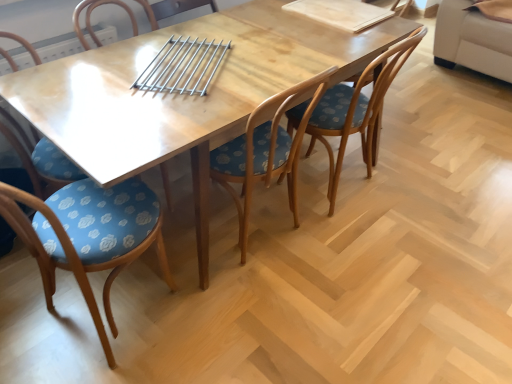
Question: From a real-world perspective, is wooden chair with floral cushion at center, the second chair in the right-to-left sequence, positioned above or below wooden table at center?

Choices:
 (A) above
 (B) below

Answer: (A)

Question: In terms of width, does wooden chair with floral cushion at center, the second chair in the right-to-left sequence, look wider or thinner when compared to wooden table at center?

Choices:
 (A) thin
 (B) wide

Answer: (A)

Question: Based on their relative distances, which object is farther from the blue fabric chair at center, marked as the second chair in a left-to-right arrangement?

Choices:
 (A) wooden chair with floral cushion at center, the second chair in the right-to-left sequence
 (B) wooden chair with floral cushion at center, acting as the 1th chair starting from the right
 (C) wooden table at center
 (D) blue floral fabric chair at lower left, which is the 1th chair from left to right

Answer: (B)

Question: Which object is positioned closest to the wooden table at center?

Choices:
 (A) wooden chair with floral cushion at center, acting as the 1th chair starting from the right
 (B) blue fabric chair at center, positioned as the 3th chair in right-to-left order
 (C) blue floral fabric chair at lower left, the 4th chair positioned from the right
 (D) wooden chair with floral cushion at center, acting as the third chair starting from the left

Answer: (D)